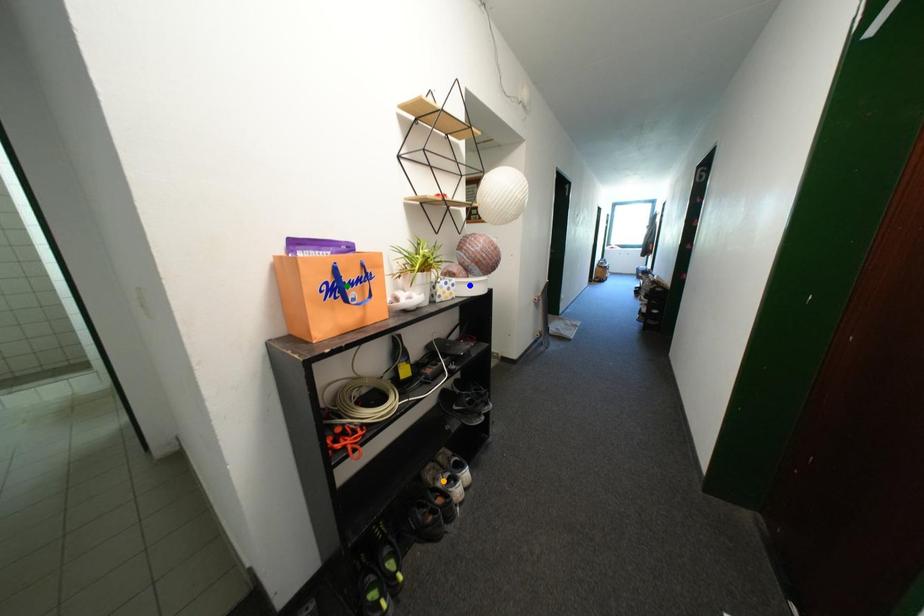
Order these from farthest to nearest:
1. green point
2. blue point
3. orange point

orange point
blue point
green point